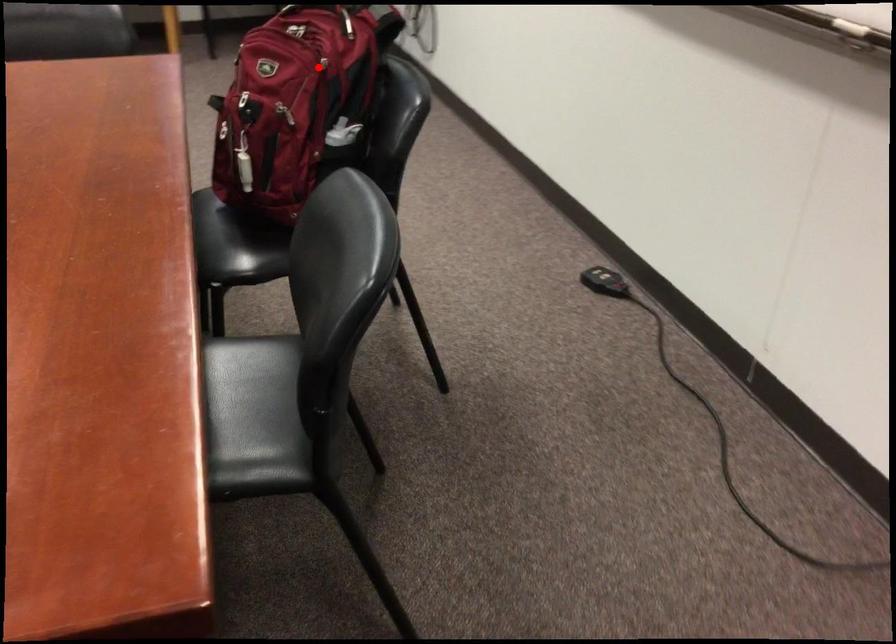
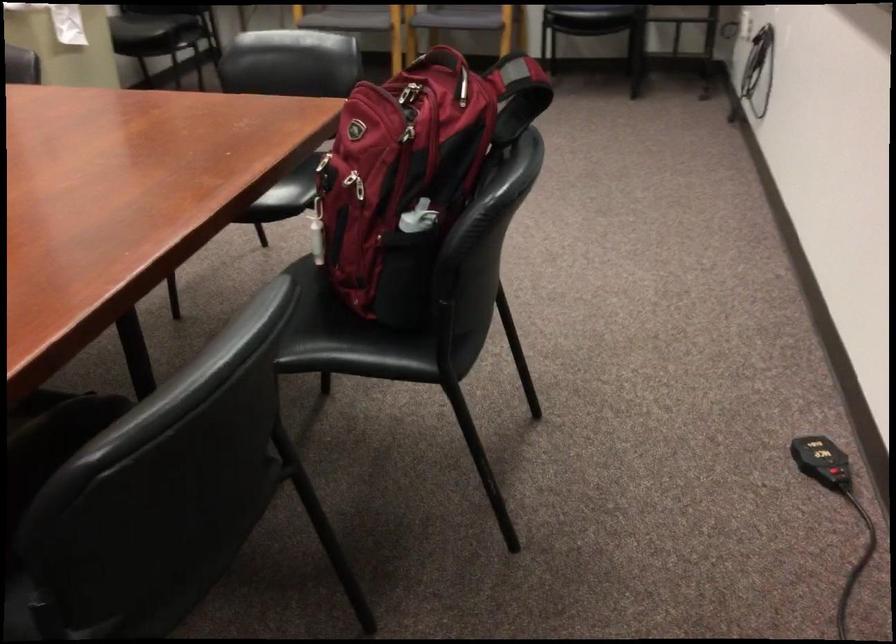
Locate, in the second image, the point that corresponds to the highlighted location in the first image.

(412, 136)